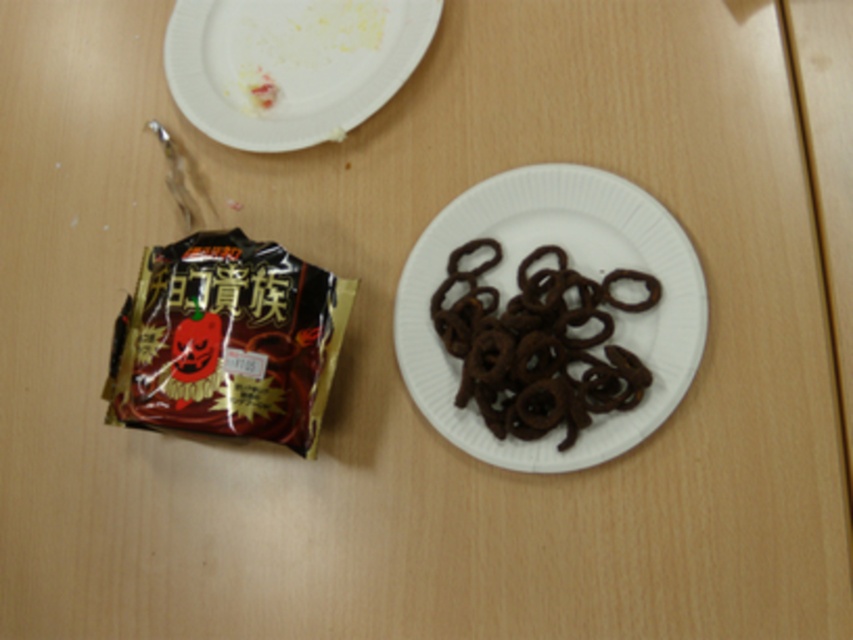
Question: Does white paper plate at center have a greater width compared to black matte snack at left?

Choices:
 (A) no
 (B) yes

Answer: (B)

Question: Is white paper plate at center bigger than black matte snack at left?

Choices:
 (A) no
 (B) yes

Answer: (B)

Question: Among these objects, which one is farthest from the camera?

Choices:
 (A) white paper plate at center
 (B) black matte snack at left
 (C) white paper plate at upper left

Answer: (C)

Question: Which point is farther from the camera taking this photo?

Choices:
 (A) (296, 433)
 (B) (509, 438)
 (C) (357, 10)

Answer: (C)

Question: Which of the following is the farthest from the observer?

Choices:
 (A) white paper plate at center
 (B) white paper plate at upper left
 (C) black matte snack at left

Answer: (B)

Question: Does black matte snack at left appear on the left side of white paper plate at upper left?

Choices:
 (A) yes
 (B) no

Answer: (A)